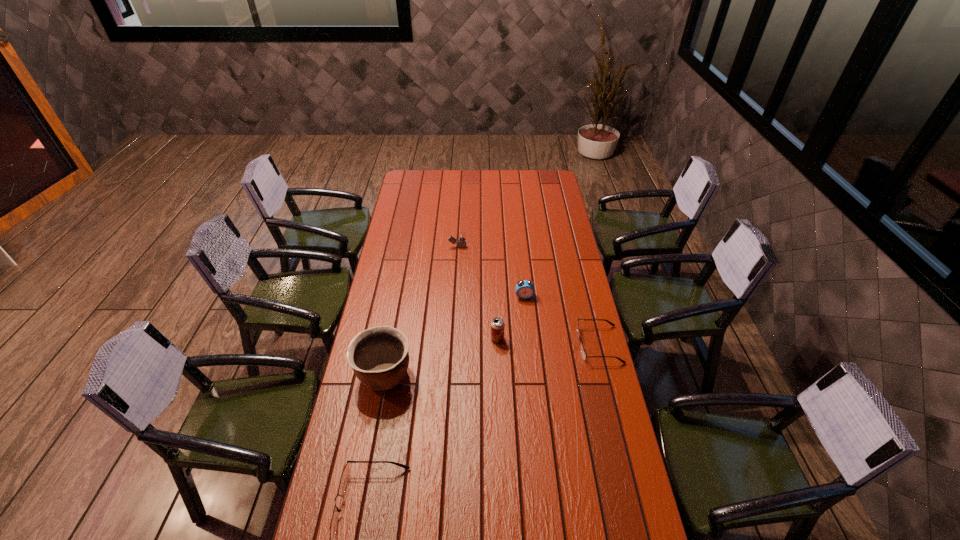
At what (x,y) coordinates should I click in order to perform the action: click on the shortest object. Please return your answer as a coordinate pair (x, y). Looking at the image, I should click on (583, 353).

Where is `the farther spectacles`? This screenshot has width=960, height=540. the farther spectacles is located at coordinates (583, 353).

This screenshot has width=960, height=540. What are the coordinates of `igniter` in the screenshot? It's located at (461, 236).

Locate an element on the screen. the farthest object is located at coordinates (461, 236).

Where is `pottery`? pottery is located at coordinates (379, 357).

You are a GUI agent. You are given a task and a screenshot of the screen. Output one action in this format:
    pyautogui.click(x=<x>, y=<y>)
    Task: Click on the second object from right to left
    This screenshot has width=960, height=540.
    Given the screenshot: What is the action you would take?
    pyautogui.click(x=525, y=289)

The width and height of the screenshot is (960, 540). What are the coordinates of `alarm clock` in the screenshot? It's located at (525, 289).

Where is `the fourth object from left to right`? the fourth object from left to right is located at coordinates (497, 325).

Find the location of a particular element. free location located 0.220m on the front-facing side of the right spectacles is located at coordinates (521, 345).

The image size is (960, 540). What are the coordinates of `free location located 0.250m on the front-facing side of the right spectacles` in the screenshot? It's located at (515, 345).